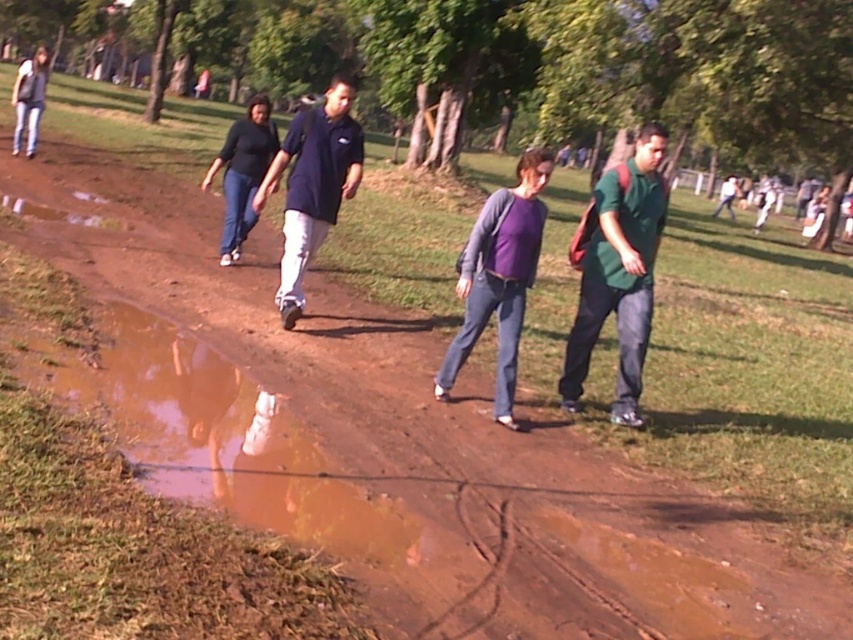
Question: Which point appears farthest from the camera in this image?

Choices:
 (A) (537, 156)
 (B) (305, 140)

Answer: (B)

Question: Does brown muddy puddle at lower left come behind green matte shirt at center?

Choices:
 (A) no
 (B) yes

Answer: (A)

Question: Can you confirm if brown muddy puddle at lower left is bigger than green matte shirt at center?

Choices:
 (A) no
 (B) yes

Answer: (B)

Question: Which point is farther to the camera?

Choices:
 (A) (508, 358)
 (B) (136, 310)
 (C) (646, 316)
 (D) (293, 122)

Answer: (D)

Question: Which point is farther from the camera taking this photo?

Choices:
 (A) (305, 444)
 (B) (595, 259)

Answer: (B)

Question: Does green matte shirt at center appear on the right side of dark blue shirt at center?

Choices:
 (A) no
 (B) yes

Answer: (B)